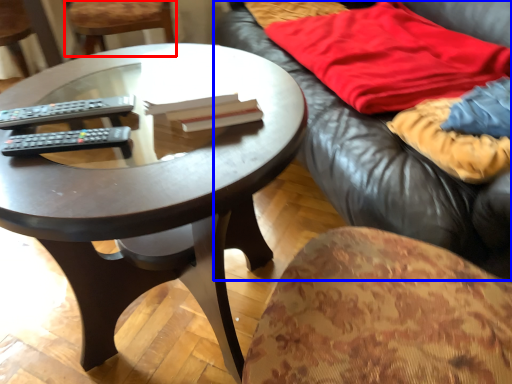
Question: Among these objects, which one is farthest to the camera, chair (highlighted by a red box) or studio couch (highlighted by a blue box)?

Choices:
 (A) chair
 (B) studio couch

Answer: (A)